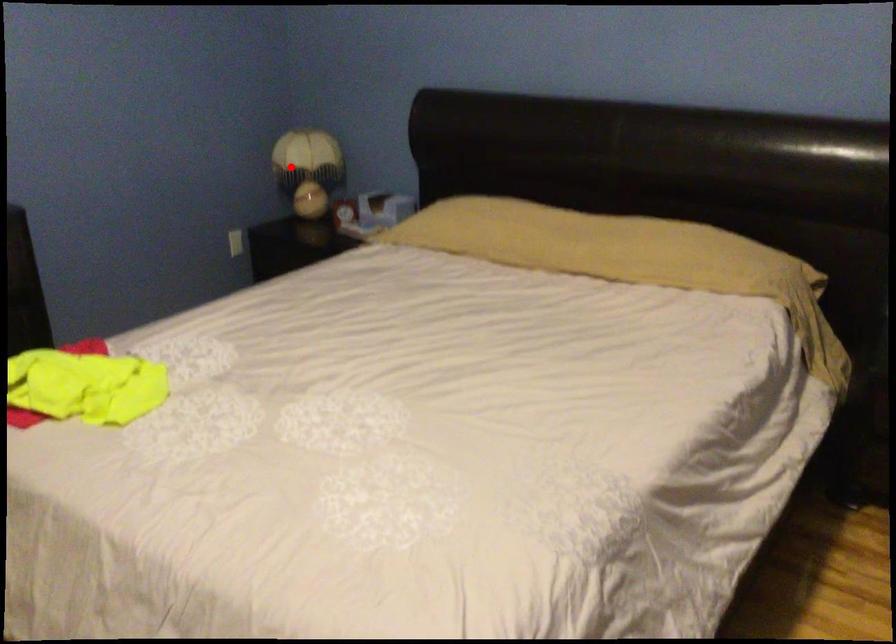
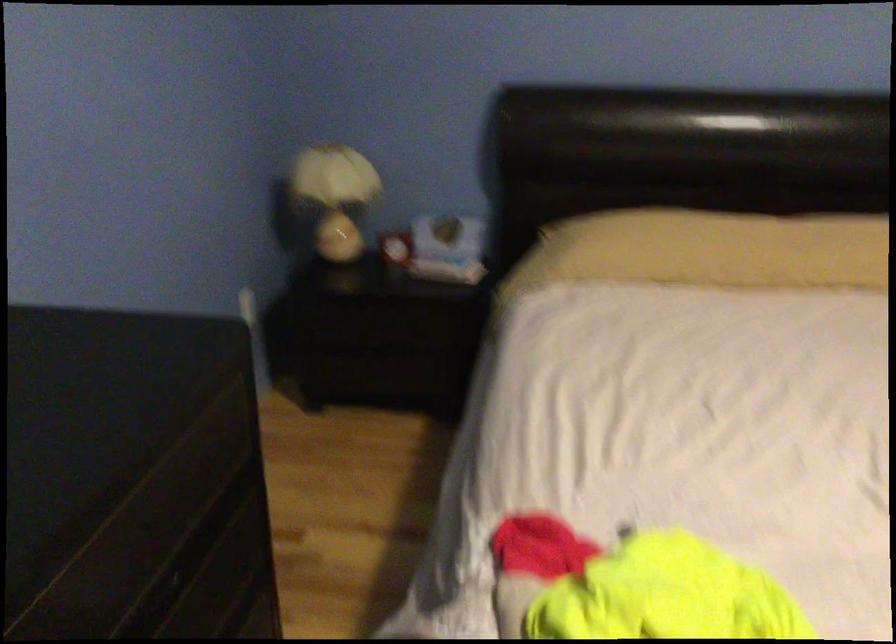
Question: I am providing you with two images of the same scene from different viewpoints. A red point is shown in image1. For the corresponding object point in image2, is it positioned nearer or farther from the camera?

Choices:
 (A) Nearer
 (B) Farther

Answer: (A)